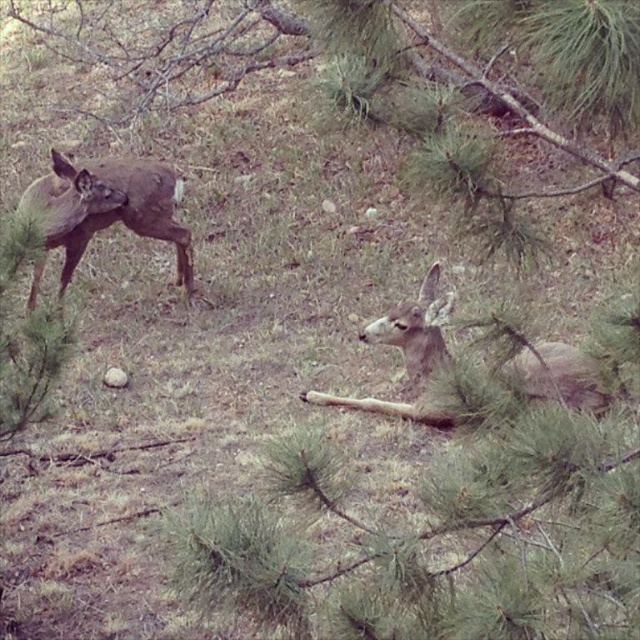
You are a photographer trying to capture both the fawn fur at lower right and the brown matte deer at left in a single frame. Based on their positions, which deer should you focus on first to ensure both are in focus?

The fawn fur at lower right is located below the brown matte deer at left. To capture both in focus, you should focus on the brown matte deer at left first since it is closer to the camera, ensuring the fawn fur at lower right will also be in focus due to its position behind.

You are a photographer trying to capture both the fawn fur at lower right and the brown matte deer at left in a single shot. Based on their positions, which deer will appear larger in the photo?

The fawn fur at lower right will appear larger in the photo because it is closer to the viewer than the brown matte deer at left.

You are a hiker trying to navigate through the forest. You see two points marked in the scene. Which point is closer to you, point (320, 401) or point (161, 188)?

Point (320, 401) is in front of point (161, 188), so it is closer to you.